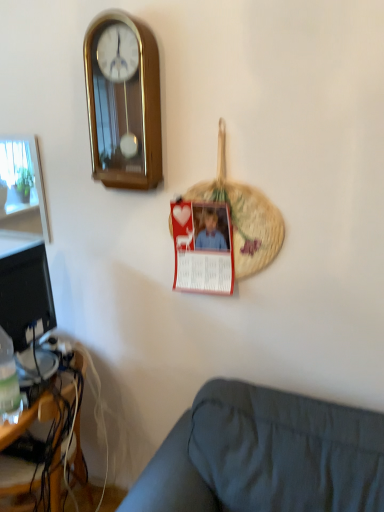
Question: Is wooden desk at lower left wider or thinner than red paper postcard at center?

Choices:
 (A) wide
 (B) thin

Answer: (A)

Question: Is wooden desk at lower left in front of or behind red paper postcard at center in the image?

Choices:
 (A) behind
 (B) front

Answer: (A)

Question: Based on their relative distances, which object is farther from the wooden desk at lower left?

Choices:
 (A) translucent plastic bottle at lower left
 (B) dark gray fabric couch at lower right
 (C) gold polished wood wall clock at upper left
 (D) red paper postcard at center

Answer: (C)

Question: Which object is the closest to the dark gray fabric couch at lower right?

Choices:
 (A) red paper postcard at center
 (B) wooden desk at lower left
 (C) translucent plastic bottle at lower left
 (D) gold polished wood wall clock at upper left

Answer: (A)